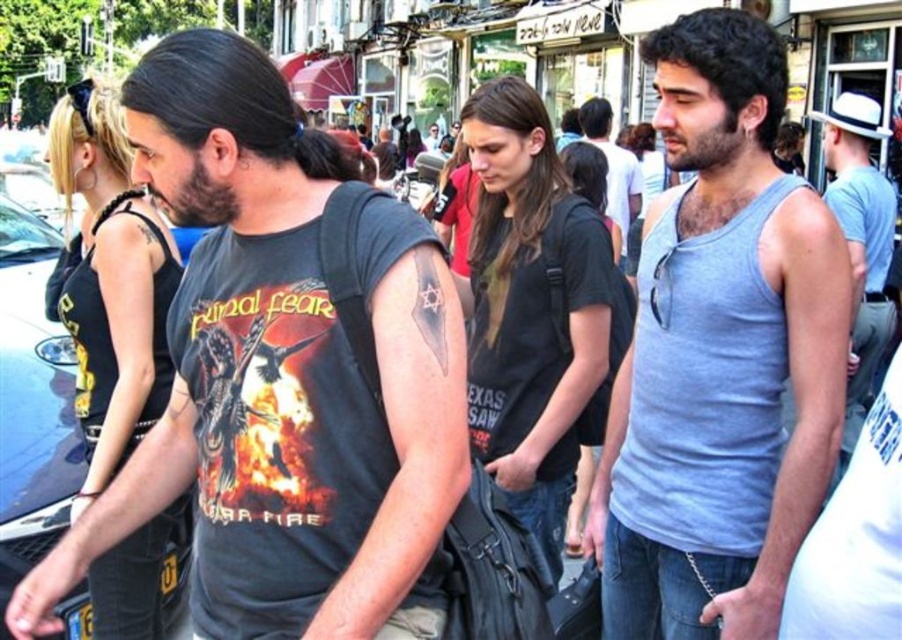
You are a photographer standing at the edge of the sidewalk. You want to take a photo of the metallic blue car at left and the gray cotton tank top at center. Which object will appear larger in your photo?

The gray cotton tank top at center will appear larger in the photo because it is closer to the viewer than the metallic blue car at left.

Looking at this image, you are a pedestrian standing on the sidewalk and see the gray cotton tank top at center and the metallic blue car at left. Which object is closer to you?

The gray cotton tank top at center is closer to you because it is positioned under the metallic blue car at left, meaning it is in front of the car from your perspective.